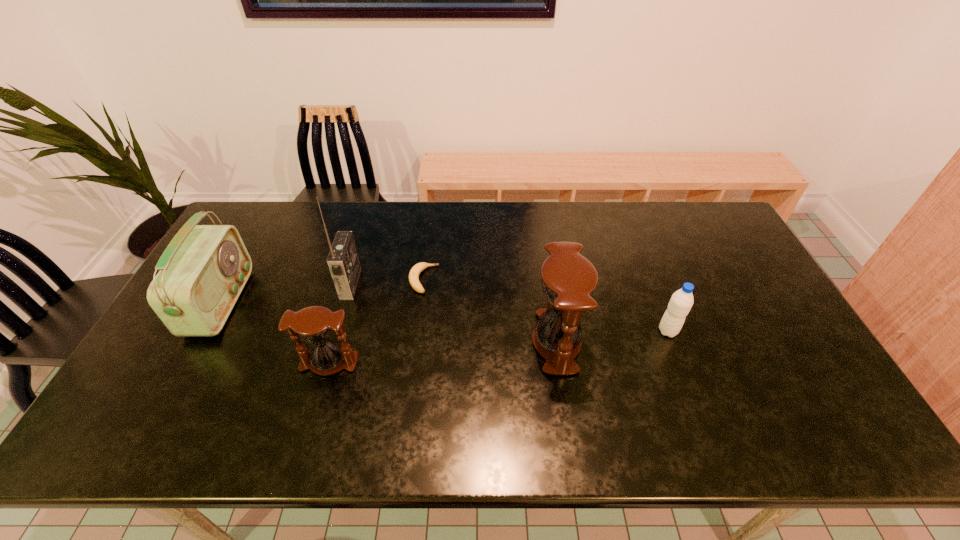
Image resolution: width=960 pixels, height=540 pixels. In order to click on the fifth closest object to the tallest object in this screenshot , I will do `click(682, 300)`.

Where is `free space that satisfies the following two spatial constraints: 1. on the display of the shorter hourglass; 2. on the left side of the right radio receiver`? This screenshot has height=540, width=960. free space that satisfies the following two spatial constraints: 1. on the display of the shorter hourglass; 2. on the left side of the right radio receiver is located at coordinates (327, 362).

Where is `free region that satisfies the following two spatial constraints: 1. on the back side of the shorter hourglass; 2. on the display of the tallest object`? free region that satisfies the following two spatial constraints: 1. on the back side of the shorter hourglass; 2. on the display of the tallest object is located at coordinates (351, 284).

I want to click on vacant space that satisfies the following two spatial constraints: 1. on the display of the taller radio receiver; 2. on the back side of the water bottle, so 337,331.

Identify the location of vacant region that satisfies the following two spatial constraints: 1. on the display of the tallest object; 2. on the back side of the left hourglass. (327, 362).

Find the location of a particular element. The image size is (960, 540). free space that satisfies the following two spatial constraints: 1. on the front panel of the left radio receiver; 2. on the right side of the left hourglass is located at coordinates (187, 362).

Where is `free space that satisfies the following two spatial constraints: 1. on the display of the water bottle; 2. on the left side of the right radio receiver`? free space that satisfies the following two spatial constraints: 1. on the display of the water bottle; 2. on the left side of the right radio receiver is located at coordinates click(x=337, y=331).

The image size is (960, 540). In order to click on vacant region that satisfies the following two spatial constraints: 1. on the front side of the water bottle; 2. on the left side of the fourth object from left to right in this screenshot , I will do `click(418, 331)`.